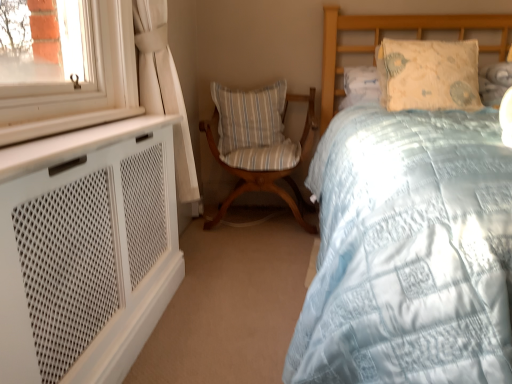
The image size is (512, 384). Identify the location of free spot below woodenchair at center (from a real-world perspective). [256, 222].